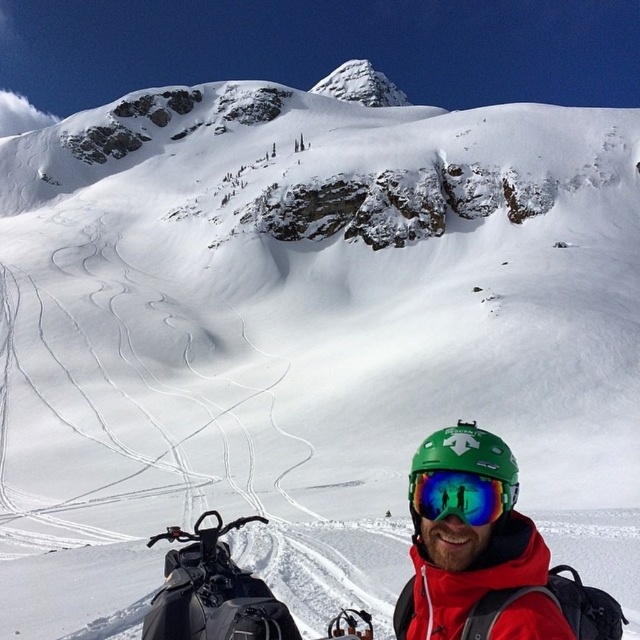
Is black matte snowmobile at lower left to the right of green matte helmet at lower center from the viewer's perspective?

Incorrect, black matte snowmobile at lower left is not on the right side of green matte helmet at lower center.

Does black matte snowmobile at lower left have a lesser width compared to green matte helmet at lower center?

No, black matte snowmobile at lower left is not thinner than green matte helmet at lower center.

Measure the distance between point [198,582] and camera.

38.61 meters

Find the location of a particular element. black matte snowmobile at lower left is located at coordinates (212, 589).

Between green matte helmet at lower center and transparent reflective goggles at center, which one appears on the left side from the viewer's perspective?

transparent reflective goggles at center

Which of these two, green matte helmet at lower center or transparent reflective goggles at center, stands taller?

green matte helmet at lower center is taller.

Measure the distance between green matte helmet at lower center and camera.

A distance of 114.56 feet exists between green matte helmet at lower center and camera.

At what (x,y) coordinates should I click in order to perform the action: click on green matte helmet at lower center. Please return your answer as a coordinate pair (x, y). Looking at the image, I should click on (460, 492).

Does black matte snowmobile at lower left appear under transparent reflective goggles at center?

Yes, black matte snowmobile at lower left is below transparent reflective goggles at center.

Which is in front, point (285, 621) or point (412, 518)?

Point (285, 621) is in front.

The width and height of the screenshot is (640, 640). I want to click on black matte snowmobile at lower left, so click(x=212, y=589).